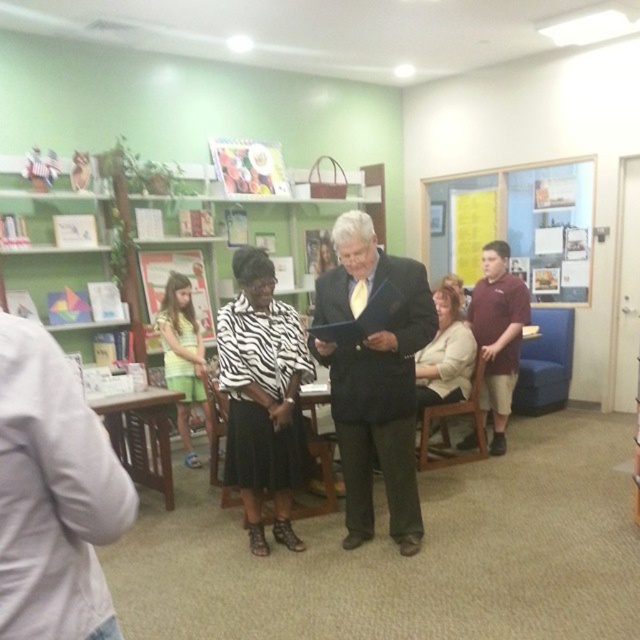
You are standing in the community center and see two people at the center. The person wearing the matte black suit at center and the person wearing the zebra print blouse at center. Which one is positioned to the left?

The matte black suit at center is positioned to the left of the zebra print blouse at center.

What are the coordinates of the zebra print blouse at center?

The zebra print blouse at center is located at coordinates point (262, 396).